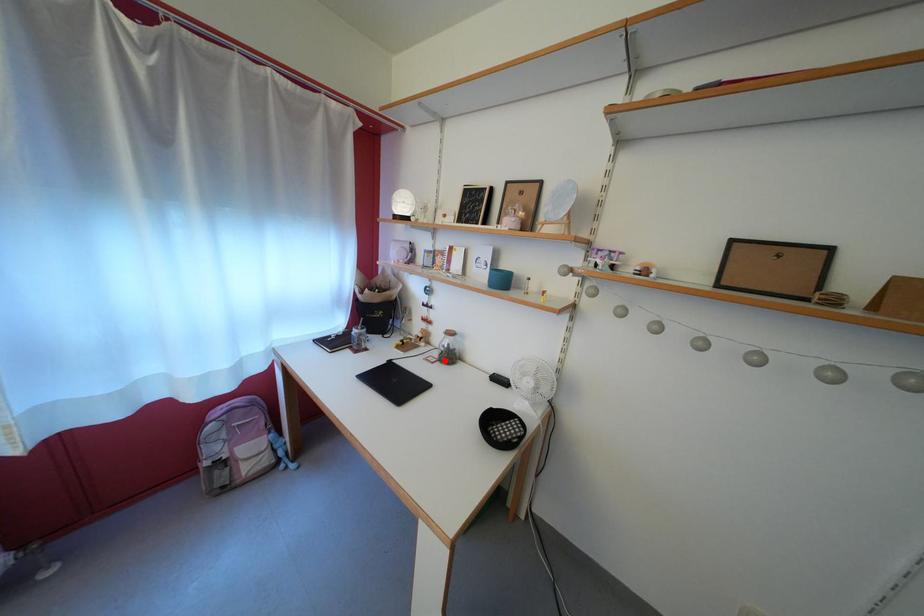
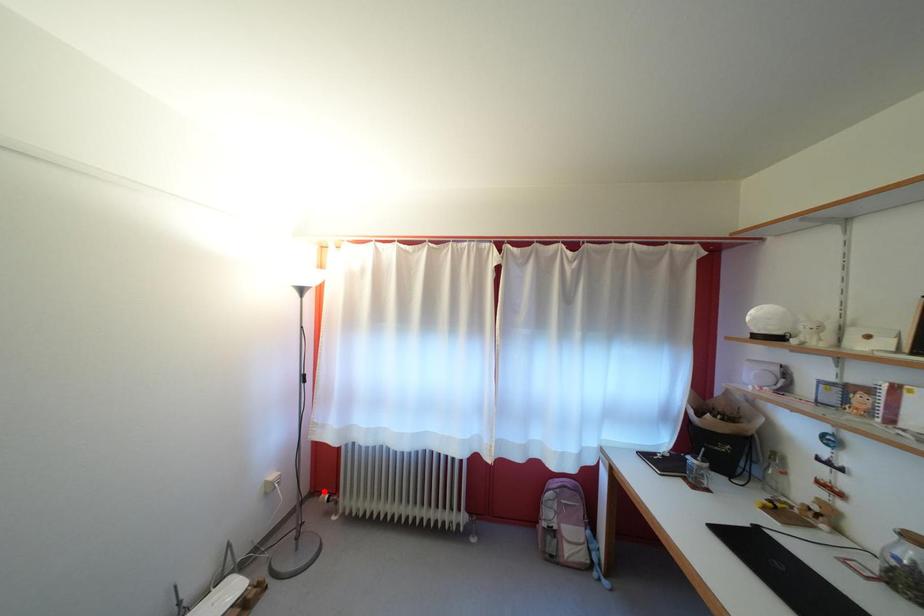
I am providing you with two images of the same scene from different viewpoints. A red point is marked on the first image and another point is marked on the second image. Does the point marked in image1 correspond to the same location as the one in image2?

No